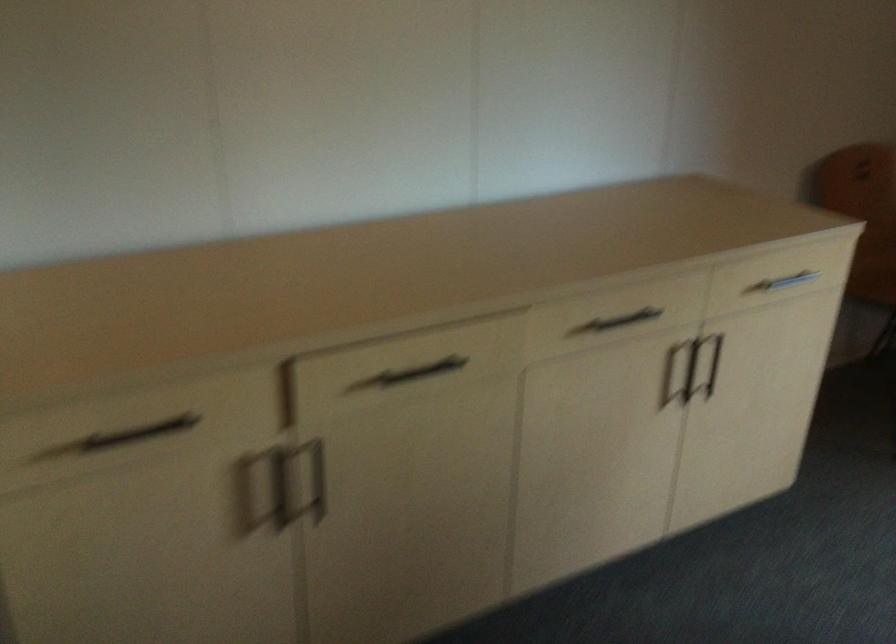
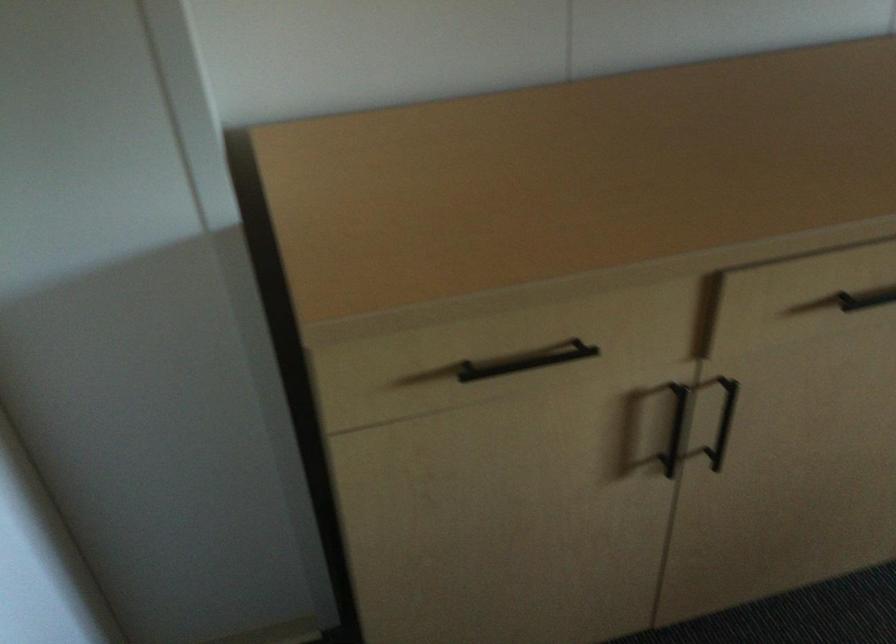
The point at (288,487) is marked in the first image. Where is the corresponding point in the second image?

(675, 428)